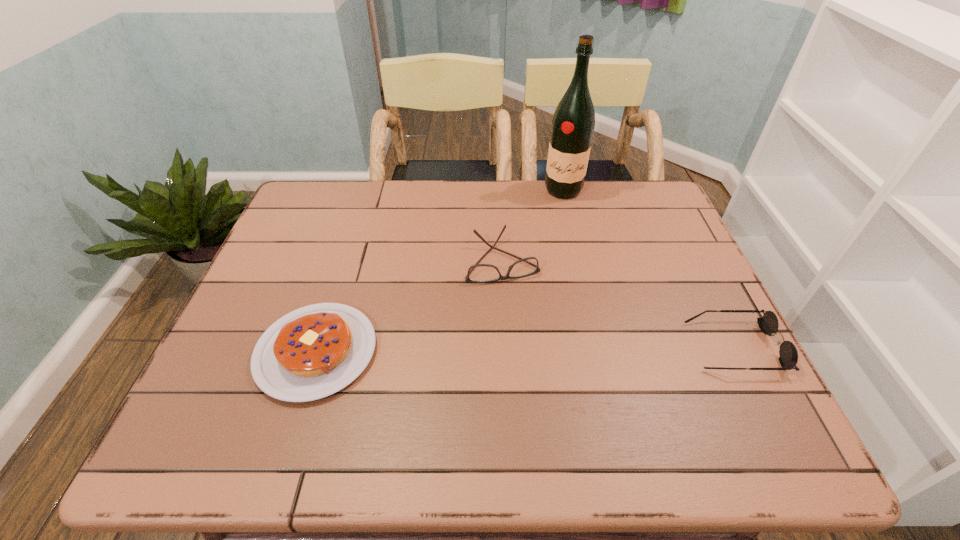
Find the location of a particular element. This screenshot has height=540, width=960. free spot on the desktop that is between the pancake and the sunglasses and is positioned on the front-facing side of the third object from right to left is located at coordinates (532, 349).

Locate an element on the screen. free spot on the desktop that is between the leftmost object and the rightmost object and is positioned on the front-facing side of the tallest object is located at coordinates (540, 349).